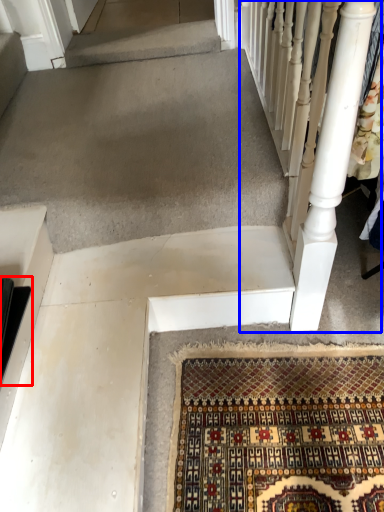
Question: Which of the following is the closest to the observer, stairs (highlighted by a red box) or rail (highlighted by a blue box)?

Choices:
 (A) stairs
 (B) rail

Answer: (B)